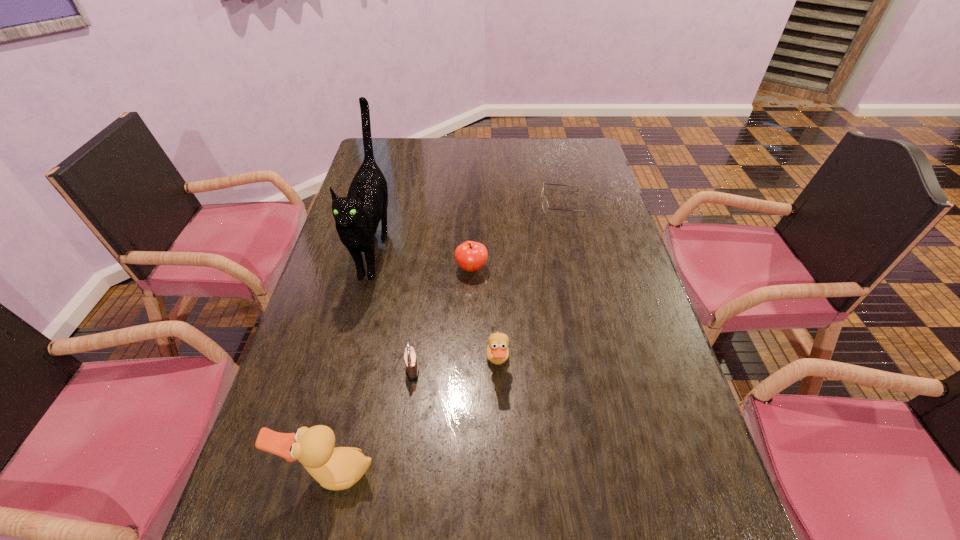
Locate an element on the screen. This screenshot has height=540, width=960. blank space that satisfies the following two spatial constraints: 1. on the beak of the farther duck; 2. on the beak of the second tallest object is located at coordinates (501, 474).